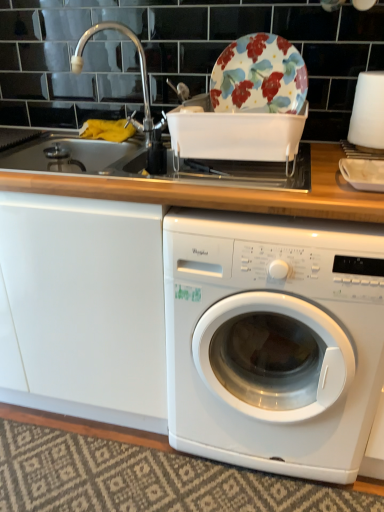
Question: From the image's perspective, does white matte plate at right appear higher than silver metallic faucet at upper left?

Choices:
 (A) no
 (B) yes

Answer: (A)

Question: Is white matte plate at right not close to silver metallic faucet at upper left?

Choices:
 (A) yes
 (B) no

Answer: (B)

Question: Is white matte plate at right oriented towards silver metallic faucet at upper left?

Choices:
 (A) yes
 (B) no

Answer: (B)

Question: Is the position of white matte plate at right less distant than that of silver metallic faucet at upper left?

Choices:
 (A) yes
 (B) no

Answer: (A)

Question: Are white matte plate at right and silver metallic faucet at upper left making contact?

Choices:
 (A) yes
 (B) no

Answer: (B)

Question: From the image's perspective, would you say white matte plate at right is shown under silver metallic faucet at upper left?

Choices:
 (A) yes
 (B) no

Answer: (A)

Question: Is floral ceramic plate at upper center turned away from silver metallic faucet at upper left?

Choices:
 (A) no
 (B) yes

Answer: (A)

Question: From the image's perspective, is floral ceramic plate at upper center under silver metallic faucet at upper left?

Choices:
 (A) yes
 (B) no

Answer: (A)

Question: Can you confirm if floral ceramic plate at upper center is taller than silver metallic faucet at upper left?

Choices:
 (A) no
 (B) yes

Answer: (A)

Question: Considering the relative positions of floral ceramic plate at upper center and silver metallic faucet at upper left in the image provided, is floral ceramic plate at upper center to the right of silver metallic faucet at upper left from the viewer's perspective?

Choices:
 (A) no
 (B) yes

Answer: (B)

Question: Is silver metallic faucet at upper left a part of floral ceramic plate at upper center?

Choices:
 (A) no
 (B) yes

Answer: (A)

Question: Considering the relative sizes of floral ceramic plate at upper center and silver metallic faucet at upper left in the image provided, is floral ceramic plate at upper center shorter than silver metallic faucet at upper left?

Choices:
 (A) no
 (B) yes

Answer: (B)

Question: Does silver metallic faucet at upper left have a greater height compared to white matte plate at right?

Choices:
 (A) no
 (B) yes

Answer: (B)